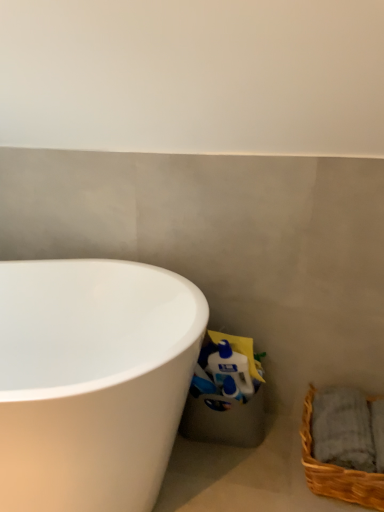
Question: Is point (306, 474) closer or farther from the camera than point (16, 322)?

Choices:
 (A) closer
 (B) farther

Answer: (A)

Question: From a real-world perspective, relative to white glossy bathtub at lower left, is brown woven basket at lower right vertically above or below?

Choices:
 (A) below
 (B) above

Answer: (A)

Question: Looking at the image, does brown woven basket at lower right seem bigger or smaller compared to white glossy bathtub at lower left?

Choices:
 (A) big
 (B) small

Answer: (B)

Question: Considering their positions, is white glossy bathtub at lower left located in front of or behind brown woven basket at lower right?

Choices:
 (A) behind
 (B) front

Answer: (B)

Question: Is point (39, 414) closer or farther from the camera than point (344, 479)?

Choices:
 (A) closer
 (B) farther

Answer: (A)

Question: Is white glossy bathtub at lower left wider or thinner than brown woven basket at lower right?

Choices:
 (A) thin
 (B) wide

Answer: (B)

Question: Would you say white glossy bathtub at lower left is to the left or to the right of brown woven basket at lower right in the picture?

Choices:
 (A) right
 (B) left

Answer: (B)